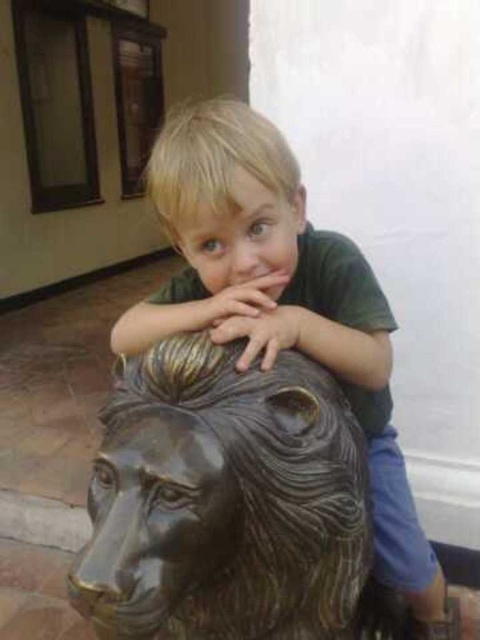
You are a photographer trying to capture the bronze textured lion head at center and the matte green shirt at center in the same frame. Based on their positions, which object should you adjust your camera to focus on first to ensure both are in the shot?

Since the bronze textured lion head at center is to the left of the matte green shirt at center, you should focus on the bronze textured lion head at center first as it is closer to the left edge of the frame, ensuring both objects remain within the camera view.

What are the coordinates of the bronze textured lion head at center?

The bronze textured lion head at center is located at coordinates point (224, 500).

You are an art student analyzing the statue of the bear head. You notice a specific point at coordinates point (x=224, y=500). What object is located at this point?

The point (x=224, y=500) marks the bronze textured lion head at center.